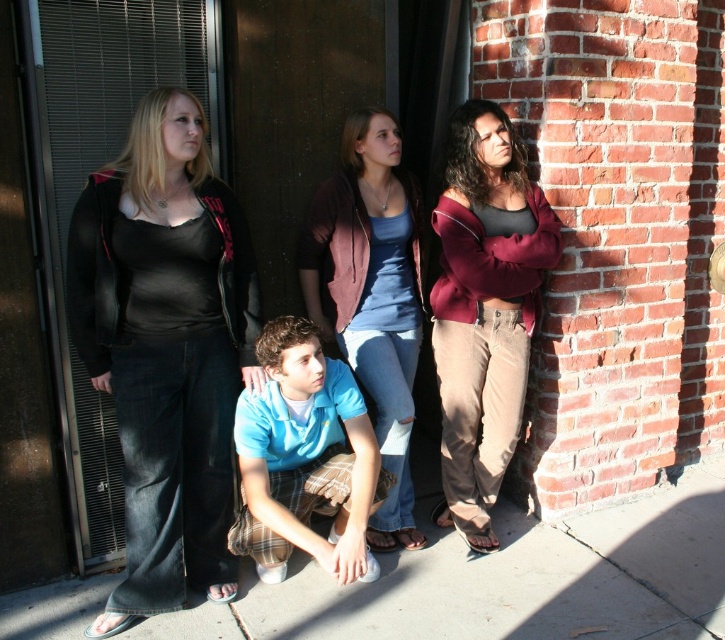
Is maroon fleece jacket at right thinner than blue cotton shirt at center?

Indeed, maroon fleece jacket at right has a lesser width compared to blue cotton shirt at center.

Which is in front, point (509, 451) or point (347, 477)?

Point (347, 477)

Identify the location of maroon fleece jacket at right. click(484, 308).

Who is higher up, smooth concrete pavement at lower center or blue cotton shirt at center?

blue cotton shirt at center

Is smooth concrete pavement at lower center to the right of blue cotton shirt at center from the viewer's perspective?

Indeed, smooth concrete pavement at lower center is positioned on the right side of blue cotton shirt at center.

The width and height of the screenshot is (725, 640). Find the location of `smooth concrete pavement at lower center`. smooth concrete pavement at lower center is located at coordinates (509, 580).

Is point (526, 179) positioned behind point (406, 280)?

No, (526, 179) is closer to viewer.

Is maroon fleece jacket at right shorter than blue denim jeans at center?

Incorrect, maroon fleece jacket at right's height does not fall short of blue denim jeans at center's.

Is point (518, 381) farther from viewer compared to point (381, 538)?

No, (518, 381) is in front of (381, 538).

You are a GUI agent. You are given a task and a screenshot of the screen. Output one action in this format:
    pyautogui.click(x=<x>, y=<y>)
    Task: Click on the maroon fleece jacket at right
    
    Given the screenshot: What is the action you would take?
    pyautogui.click(x=484, y=308)